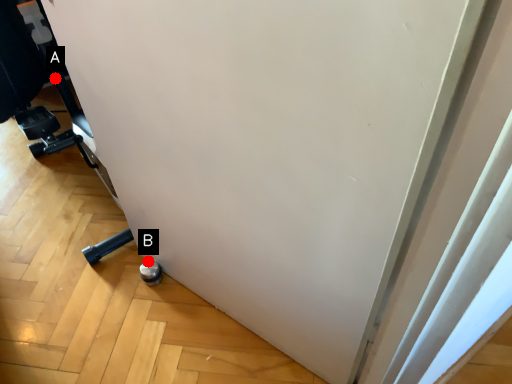
Question: Two points are circled on the image, labeled by A and B beside each circle. Which point is closer to the camera?

Choices:
 (A) A is closer
 (B) B is closer

Answer: (B)